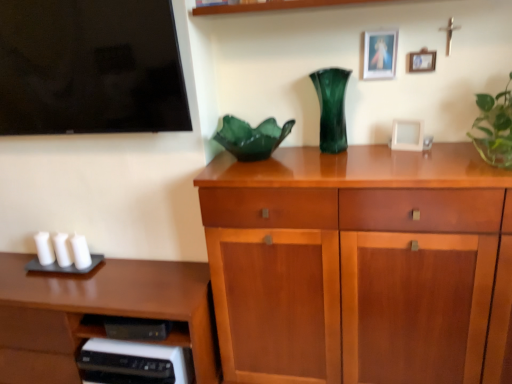
Where is `vacant space in front of white matte candle at left, which is the 2th candle in right-to-left order`? This screenshot has width=512, height=384. vacant space in front of white matte candle at left, which is the 2th candle in right-to-left order is located at coordinates (38, 289).